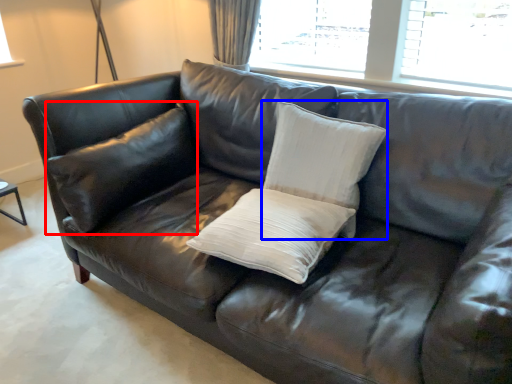
Question: Which object appears closest to the camera in this image, pillow (highlighted by a red box) or pillow (highlighted by a blue box)?

Choices:
 (A) pillow
 (B) pillow

Answer: (B)